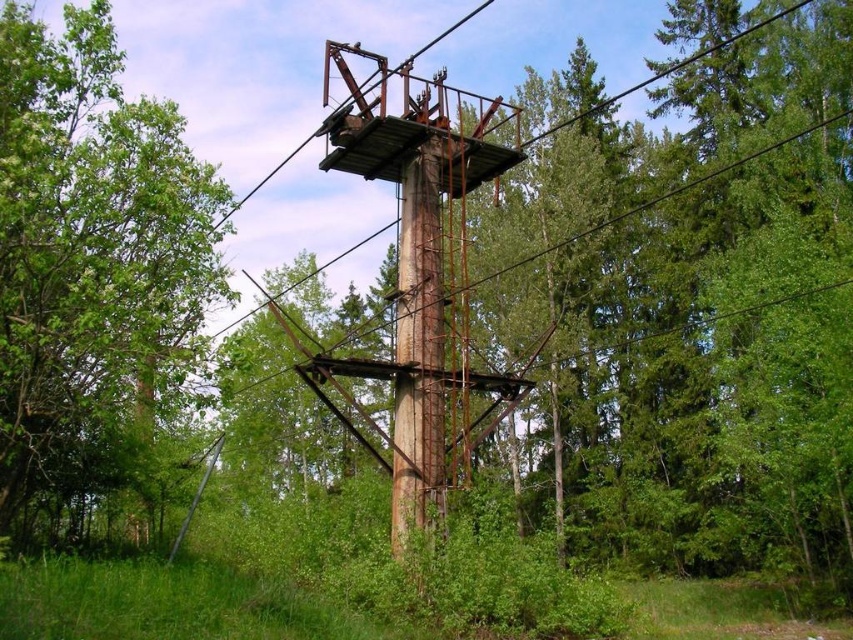
Does rusty metal pole at center appear on the right side of rusty metal tower at center?

No, rusty metal pole at center is not to the right of rusty metal tower at center.

Which is in front, point (392, 492) or point (463, 20)?

Point (392, 492) is in front.

Does point (402, 392) lie in front of point (581, 113)?

Yes, it is in front of point (581, 113).

Identify the location of rusty metal pole at center. (418, 352).

Who is higher up, rusty metal observation tower at center or rusty metal tower at center?

Positioned higher is rusty metal tower at center.

Is rusty metal observation tower at center positioned behind rusty metal tower at center?

Yes, rusty metal observation tower at center is behind rusty metal tower at center.

Does point (486, 147) come closer to viewer compared to point (682, 60)?

Yes.

The width and height of the screenshot is (853, 640). Find the location of `rusty metal observation tower at center`. rusty metal observation tower at center is located at coordinates (422, 276).

Is rusty metal observation tower at center bigger than rusty metal pole at center?

Yes, rusty metal observation tower at center is bigger than rusty metal pole at center.

Is point (444, 150) behind point (422, 426)?

That is True.

Locate an element on the screen. This screenshot has height=640, width=853. rusty metal observation tower at center is located at coordinates (422, 276).